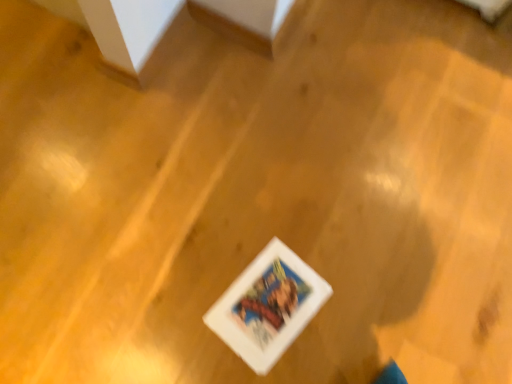
What do you see at coordinates (268, 306) in the screenshot? I see `white paper at center` at bounding box center [268, 306].

Locate an element on the screen. The image size is (512, 384). white paper at center is located at coordinates (268, 306).

At what (x,y) coordinates should I click in order to perform the action: click on white paper at center. Please return your answer as a coordinate pair (x, y). Looking at the image, I should click on (268, 306).